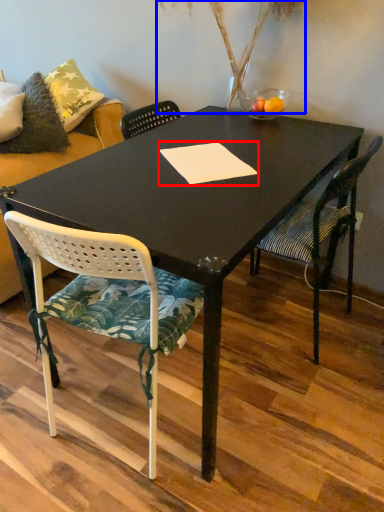
Question: Which object appears farthest to the camera in this image, notepad (highlighted by a red box) or plant (highlighted by a blue box)?

Choices:
 (A) notepad
 (B) plant

Answer: (B)